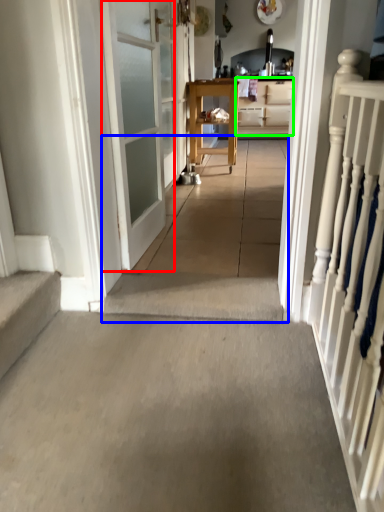
Question: Which object is the farthest from door (highlighted by a red box)? Choose among these: path (highlighted by a blue box) or cabinetry (highlighted by a green box).

Choices:
 (A) path
 (B) cabinetry

Answer: (B)